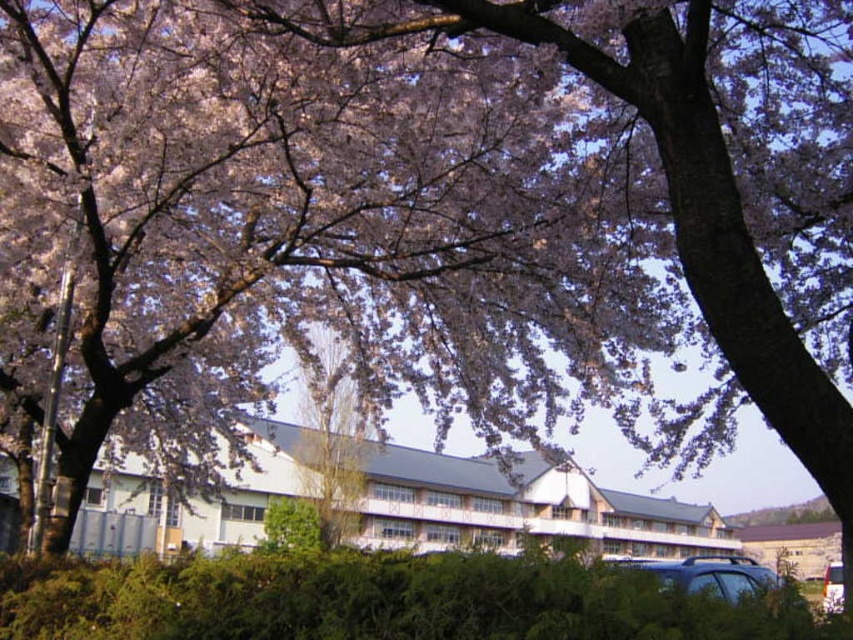
Question: Can you confirm if green leafy hedge at lower center is wider than matte black car at lower right?

Choices:
 (A) yes
 (B) no

Answer: (B)

Question: Observing the image, what is the correct spatial positioning of green leafy hedge at lower center in reference to matte black car at lower right?

Choices:
 (A) below
 (B) above

Answer: (B)

Question: Where is matte black car at lower right located in relation to white glossy van at lower right in the image?

Choices:
 (A) above
 (B) below

Answer: (B)

Question: Estimate the real-world distances between objects in this image. Which object is closer to the matte black car at lower right?

Choices:
 (A) white glossy van at lower right
 (B) green leafy hedge at lower center

Answer: (A)

Question: Which of the following is the closest to the observer?

Choices:
 (A) (326, 634)
 (B) (836, 605)
 (C) (621, 560)

Answer: (B)

Question: Estimate the real-world distances between objects in this image. Which object is closer to the white glossy van at lower right?

Choices:
 (A) green leafy hedge at lower center
 (B) matte black car at lower right

Answer: (B)